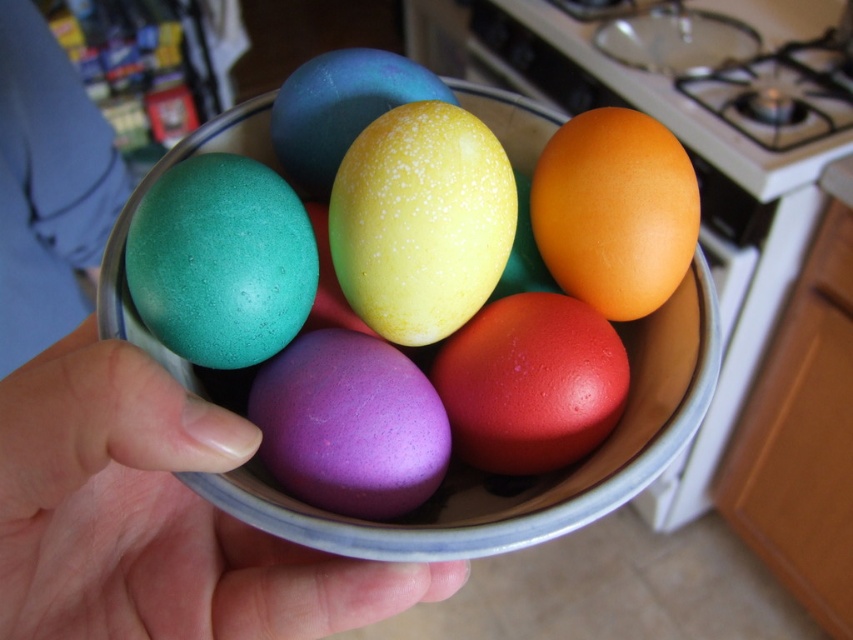
You are organizing a childrens Easter egg hunt and need to place an egg in the bowl. The bowl is at position point (x=531, y=384). Which egg should you place in the bowl?

The point (x=531, y=384) indicates the location of the matte red egg at center, so you should place the matte red egg at center in the bowl.

You are standing in the kitchen looking at the bowl of eggs. There are two points marked on the bowl. One is at coordinate point [273,572] and the other is at point [20,97]. Which point is closer to you?

Point [273,572] is in front of point [20,97], so the point at [273,572] is closer to you.